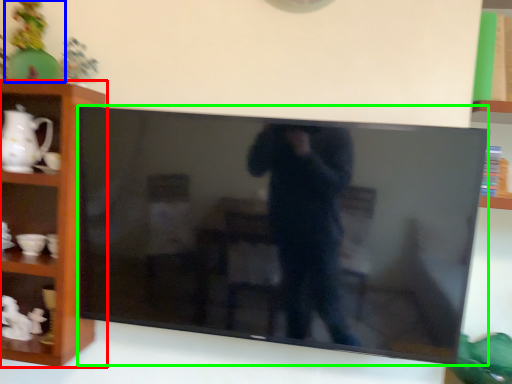
Question: Estimate the real-world distances between objects in this image. Which object is closer to shelf (highlighted by a red box), toy (highlighted by a blue box) or television (highlighted by a green box)?

Choices:
 (A) toy
 (B) television

Answer: (A)